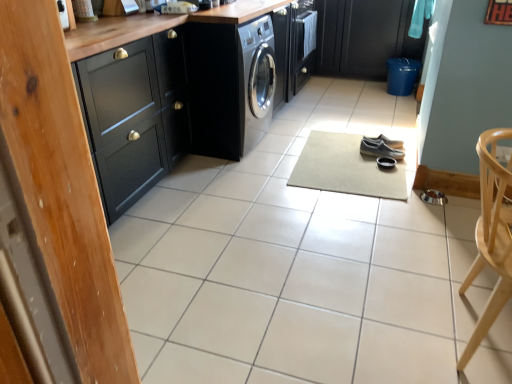
Question: Is satin black washing machine at center smaller than black leather shoes at center, which is counted as the 2th footwear, starting from the front?

Choices:
 (A) no
 (B) yes

Answer: (A)

Question: Is the depth of satin black washing machine at center less than that of black leather shoes at center, marked as the 1th footwear in a back-to-front arrangement?

Choices:
 (A) yes
 (B) no

Answer: (A)

Question: Is satin black washing machine at center beside black leather shoes at center, marked as the 1th footwear in a back-to-front arrangement?

Choices:
 (A) yes
 (B) no

Answer: (B)

Question: Is black leather shoes at center, marked as the 1th footwear in a back-to-front arrangement, at the back of satin black washing machine at center?

Choices:
 (A) no
 (B) yes

Answer: (A)

Question: Is satin black washing machine at center to the right of black leather shoes at center, marked as the 1th footwear in a back-to-front arrangement, from the viewer's perspective?

Choices:
 (A) yes
 (B) no

Answer: (B)

Question: Considering their positions, is beige carpet at center located in front of or behind black leather shoes at center, which is counted as the 2th footwear, starting from the front?

Choices:
 (A) behind
 (B) front

Answer: (B)

Question: In terms of size, does beige carpet at center appear bigger or smaller than black leather shoes at center, marked as the 1th footwear in a back-to-front arrangement?

Choices:
 (A) small
 (B) big

Answer: (B)

Question: From the image's perspective, is beige carpet at center above or below black leather shoes at center, which is counted as the 2th footwear, starting from the front?

Choices:
 (A) above
 (B) below

Answer: (B)

Question: Would you say beige carpet at center is to the left or to the right of black leather shoes at center, which is counted as the 2th footwear, starting from the front, in the picture?

Choices:
 (A) right
 (B) left

Answer: (B)

Question: Based on their positions, is beige carpet at center located to the left or right of black matte cabinet at upper right, the second cabinetry in the left-to-right sequence?

Choices:
 (A) right
 (B) left

Answer: (B)

Question: Looking at their shapes, would you say beige carpet at center is wider or thinner than black matte cabinet at upper right, the first cabinetry in the top-to-bottom sequence?

Choices:
 (A) thin
 (B) wide

Answer: (B)

Question: Is beige carpet at center inside or outside of black matte cabinet at upper right, which is the 1th cabinetry from right to left?

Choices:
 (A) outside
 (B) inside

Answer: (A)

Question: From the image's perspective, is beige carpet at center located above or below black matte cabinet at upper right, marked as the first cabinetry in a back-to-front arrangement?

Choices:
 (A) below
 (B) above

Answer: (A)

Question: Is black leather shoes at center, which is counted as the 2th footwear, starting from the front, in front of or behind beige carpet at center in the image?

Choices:
 (A) front
 (B) behind

Answer: (B)

Question: Choose the correct answer: Is black leather shoes at center, marked as the 1th footwear in a back-to-front arrangement, inside beige carpet at center or outside it?

Choices:
 (A) outside
 (B) inside

Answer: (A)